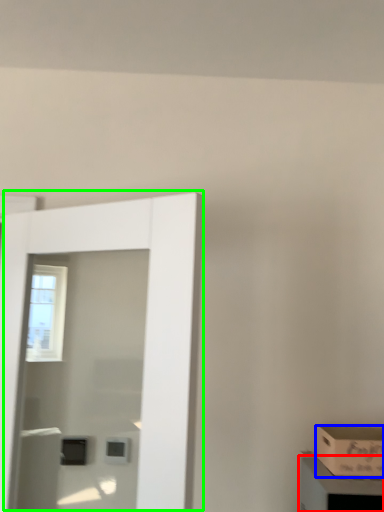
Question: Which object is positioned farthest from cabinetry (highlighted by a red box)? Select from box (highlighted by a blue box) and door (highlighted by a green box).

Choices:
 (A) box
 (B) door

Answer: (B)